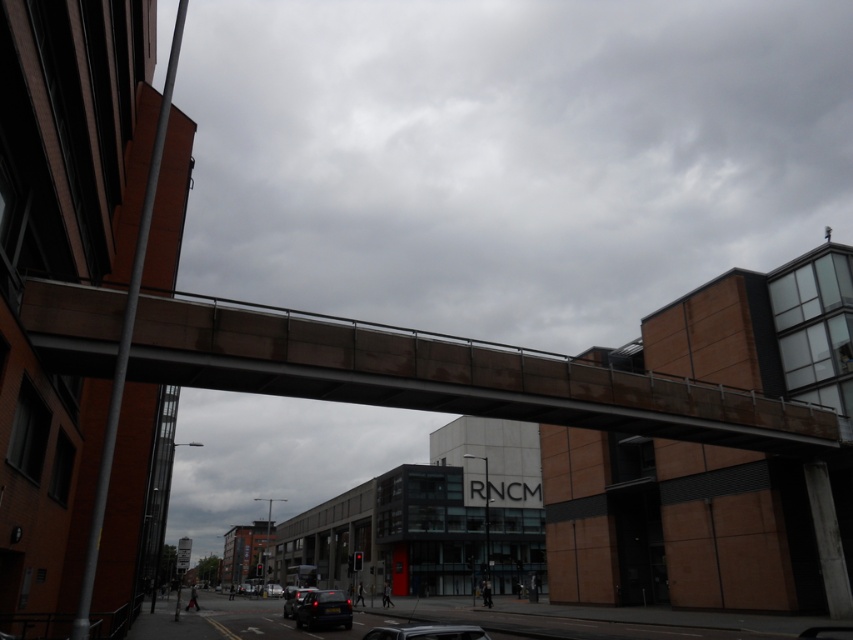
Is brown concrete bridge at center taller than shiny black car at lower center?

In fact, brown concrete bridge at center may be shorter than shiny black car at lower center.

Is point (73, 339) farther from camera compared to point (286, 598)?

No, (73, 339) is in front of (286, 598).

Image resolution: width=853 pixels, height=640 pixels. In order to click on brown concrete bridge at center in this screenshot , I will do `click(450, 376)`.

Where is `brown concrete bridge at center`? Image resolution: width=853 pixels, height=640 pixels. brown concrete bridge at center is located at coordinates (450, 376).

Does matte black car at lower center have a larger size compared to shiny black car at lower center?

Yes.

Measure the distance between point (337, 614) and camera.

21.31 meters

You are a GUI agent. You are given a task and a screenshot of the screen. Output one action in this format:
    pyautogui.click(x=<x>, y=<y>)
    Task: Click on the matte black car at lower center
    The height and width of the screenshot is (640, 853).
    Given the screenshot: What is the action you would take?
    pyautogui.click(x=323, y=609)

Looking at this image, is brown concrete bridge at center smaller than matte black car at lower center?

Correct, brown concrete bridge at center occupies less space than matte black car at lower center.

Which is more to the right, brown concrete bridge at center or matte black car at lower center?

From the viewer's perspective, brown concrete bridge at center appears more on the right side.

Locate an element on the screen. The image size is (853, 640). brown concrete bridge at center is located at coordinates (450, 376).

Locate an element on the screen. The width and height of the screenshot is (853, 640). brown concrete bridge at center is located at coordinates coord(450,376).